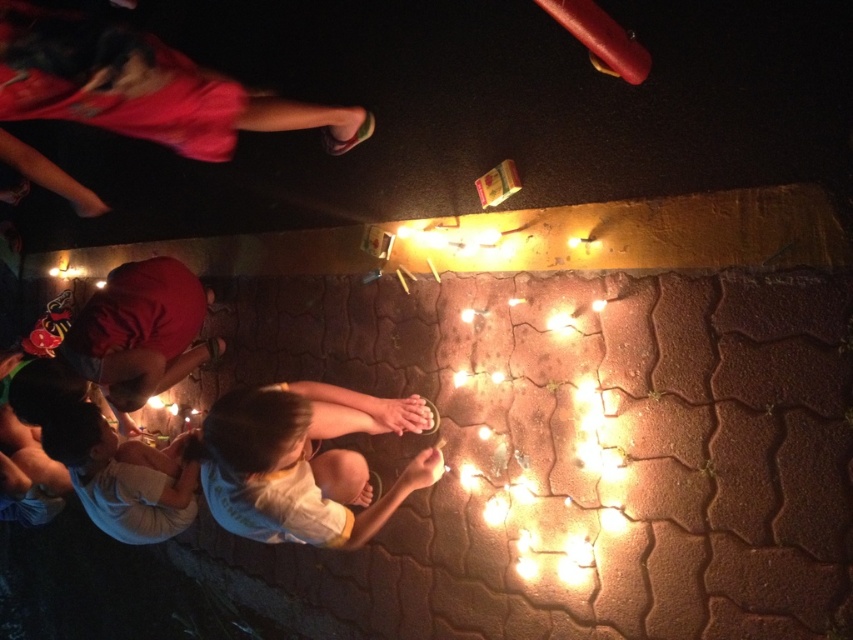
Who is lower down, white cotton shirt at center or white cotton shirt at lower left?

white cotton shirt at lower left is below.

Is white cotton shirt at center behind white cotton shirt at lower left?

No, white cotton shirt at center is in front of white cotton shirt at lower left.

Identify the location of white cotton shirt at center. This screenshot has width=853, height=640. (305, 461).

Who is taller, matte red shirt at lower left or white cotton shirt at lower left?

With more height is matte red shirt at lower left.

Which is more to the left, matte red shirt at lower left or white cotton shirt at lower left?

From the viewer's perspective, matte red shirt at lower left appears more on the left side.

Is point (125, 342) positioned in front of point (111, 518)?

No, it is not.

Where is `matte red shirt at lower left`? matte red shirt at lower left is located at coordinates pos(140,332).

Who is taller, white cotton shirt at center or matte red shirt at lower left?

Standing taller between the two is matte red shirt at lower left.

Is point (309, 442) closer to camera compared to point (138, 260)?

Yes, point (309, 442) is closer to viewer.

This screenshot has width=853, height=640. Describe the element at coordinates (305, 461) in the screenshot. I see `white cotton shirt at center` at that location.

Find the location of `white cotton shirt at center`. white cotton shirt at center is located at coordinates (305, 461).